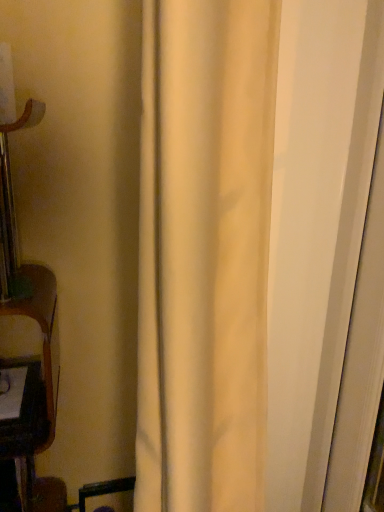
Question: From a real-world perspective, is white glossy door at right physically below beige fabric curtain at center?

Choices:
 (A) no
 (B) yes

Answer: (A)

Question: Is beige fabric curtain at center at the back of white glossy door at right?

Choices:
 (A) no
 (B) yes

Answer: (A)

Question: Does white glossy door at right contain beige fabric curtain at center?

Choices:
 (A) no
 (B) yes

Answer: (A)

Question: Does white glossy door at right have a greater width compared to beige fabric curtain at center?

Choices:
 (A) no
 (B) yes

Answer: (A)

Question: Is white glossy door at right in front of beige fabric curtain at center?

Choices:
 (A) no
 (B) yes

Answer: (A)

Question: From a real-world perspective, is white glossy door at right over beige fabric curtain at center?

Choices:
 (A) yes
 (B) no

Answer: (A)

Question: Is beige fabric curtain at center closer to camera compared to white glossy door at right?

Choices:
 (A) no
 (B) yes

Answer: (B)

Question: Is beige fabric curtain at center oriented towards white glossy door at right?

Choices:
 (A) no
 (B) yes

Answer: (A)

Question: Is beige fabric curtain at center at the left side of white glossy door at right?

Choices:
 (A) no
 (B) yes

Answer: (B)

Question: From the image's perspective, is beige fabric curtain at center beneath white glossy door at right?

Choices:
 (A) no
 (B) yes

Answer: (B)

Question: Is beige fabric curtain at center looking in the opposite direction of white glossy door at right?

Choices:
 (A) no
 (B) yes

Answer: (B)

Question: Can you confirm if beige fabric curtain at center is bigger than white glossy door at right?

Choices:
 (A) yes
 (B) no

Answer: (A)

Question: From a real-world perspective, relative to beige fabric curtain at center, is white glossy door at right vertically above or below?

Choices:
 (A) above
 (B) below

Answer: (A)